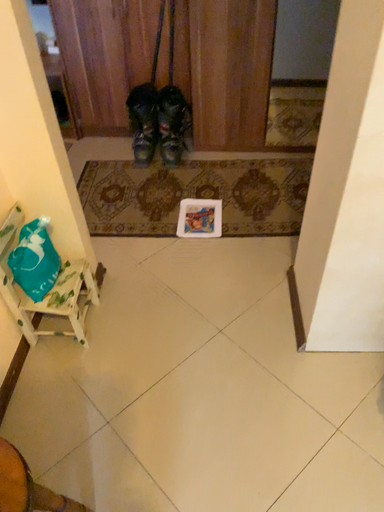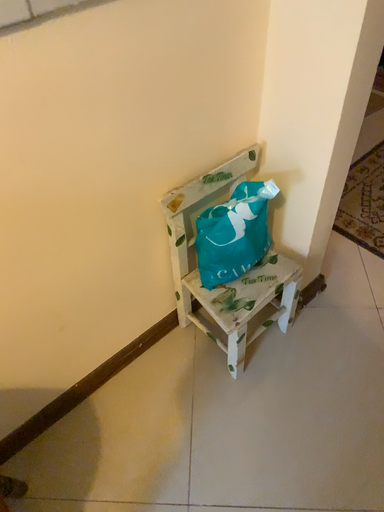
Question: How did the camera likely rotate when shooting the video?

Choices:
 (A) rotated left
 (B) rotated right

Answer: (A)